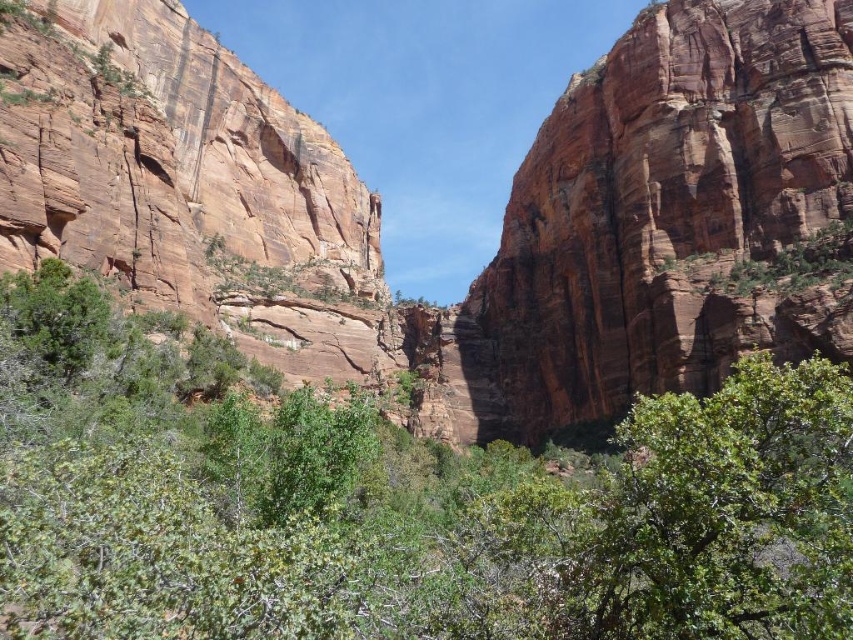
Who is more distant from viewer, (131, 376) or (541, 438)?

The point (541, 438) is behind.

At what (x,y) coordinates should I click in order to perform the action: click on green leafy shrubs at center. Please return your answer as a coordinate pair (x, y). Looking at the image, I should click on (393, 502).